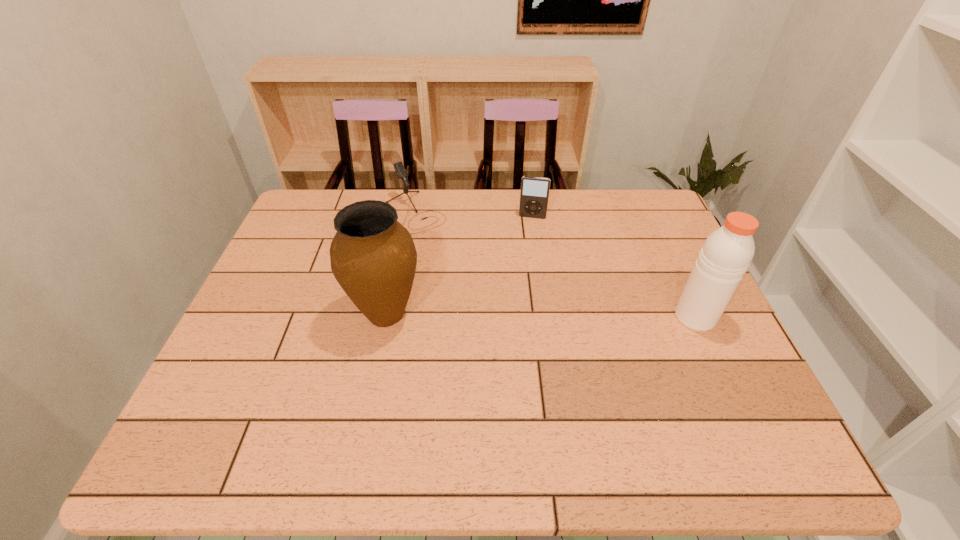
In the image, there is a desktop. Where is `vacant space at the near right corner`? vacant space at the near right corner is located at coordinates (701, 391).

The image size is (960, 540). What are the coordinates of `free area in between the shaker and the microphone` in the screenshot? It's located at (555, 265).

Where is `vacant point located between the urn and the rightmost object`? vacant point located between the urn and the rightmost object is located at coordinates (540, 315).

Image resolution: width=960 pixels, height=540 pixels. Identify the location of free space between the urn and the iPod. (460, 266).

This screenshot has height=540, width=960. Identify the location of free point between the shaker and the third object from left to right. (613, 267).

The height and width of the screenshot is (540, 960). What are the coordinates of `free space that is in between the third object from left to right and the urn` in the screenshot? It's located at click(x=460, y=266).

The width and height of the screenshot is (960, 540). What are the coordinates of `free space between the microphone and the iPod` in the screenshot? It's located at (473, 214).

Where is `object that ranks as the second closest to the urn`? The image size is (960, 540). object that ranks as the second closest to the urn is located at coordinates (534, 194).

Identify the location of object that is the closest to the rightmost object. (534, 194).

In order to click on free space that satisfies the following two spatial constraints: 1. on the front side of the microphone; 2. on the right side of the shaker in this screenshot , I will do `click(396, 317)`.